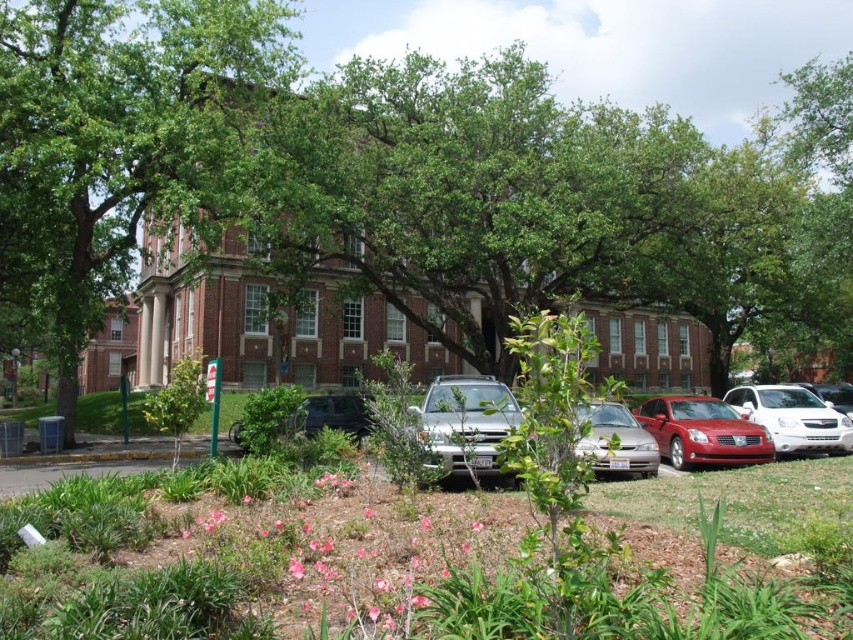
The width and height of the screenshot is (853, 640). Describe the element at coordinates (402, 177) in the screenshot. I see `green leafy tree at center` at that location.

Is green leafy tree at center further to the viewer compared to shiny red sedan at center?

Yes.

Find the location of a particular element. green leafy tree at center is located at coordinates (402, 177).

Is silver metallic suv at center positioned in front of satin silver sedan at center?

No, it is not.

Who is more distant from viewer, (436, 419) or (618, 433)?

The point (618, 433) is more distant.

This screenshot has height=640, width=853. What do you see at coordinates (466, 422) in the screenshot? I see `silver metallic suv at center` at bounding box center [466, 422].

This screenshot has width=853, height=640. In order to click on silver metallic suv at center in this screenshot , I will do `click(466, 422)`.

Does green leafy tree at left have a lesser height compared to silver metallic suv at center?

No.

Locate an element on the screen. This screenshot has width=853, height=640. green leafy tree at left is located at coordinates (115, 140).

Locate an element on the screen. Image resolution: width=853 pixels, height=640 pixels. green leafy tree at left is located at coordinates (115, 140).